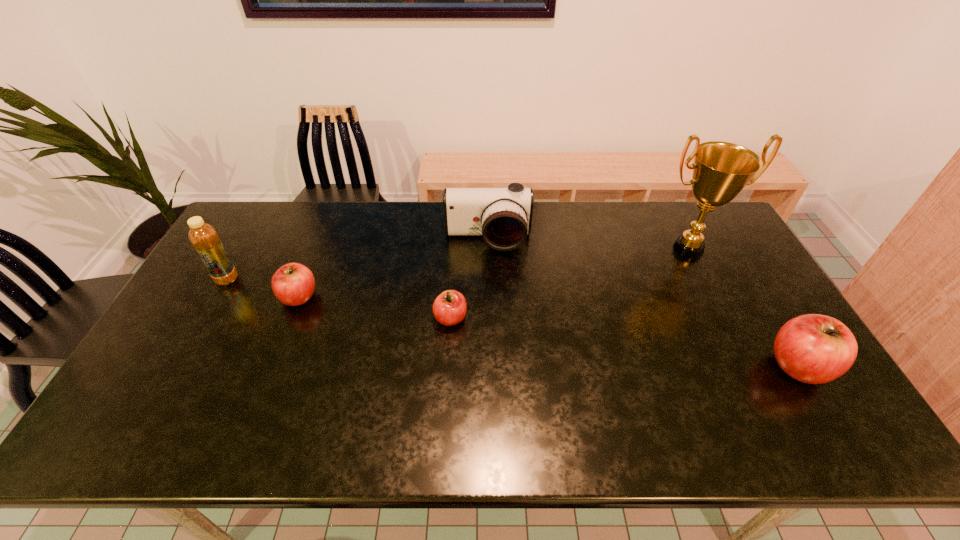
Locate an element on the screen. This screenshot has width=960, height=540. the fifth object from right to left is located at coordinates (293, 284).

Locate an element on the screen. The width and height of the screenshot is (960, 540). the second shortest apple is located at coordinates (293, 284).

The image size is (960, 540). I want to click on the second apple from right to left, so click(449, 308).

Locate an element on the screen. Image resolution: width=960 pixels, height=540 pixels. the shortest object is located at coordinates (449, 308).

The width and height of the screenshot is (960, 540). What are the coordinates of `the nearest object` in the screenshot? It's located at (815, 349).

Where is `the tallest apple`? The image size is (960, 540). the tallest apple is located at coordinates (815, 349).

This screenshot has height=540, width=960. What are the coordinates of `camcorder` in the screenshot? It's located at (503, 216).

You are a GUI agent. You are given a task and a screenshot of the screen. Output one action in this format:
    pyautogui.click(x=<x>, y=<y>)
    Task: Click on the award
    
    Given the screenshot: What is the action you would take?
    pyautogui.click(x=721, y=170)

Where is `bottle`? The width and height of the screenshot is (960, 540). bottle is located at coordinates (204, 238).

The width and height of the screenshot is (960, 540). In order to click on the fifth shortest object in this screenshot , I will do `click(204, 238)`.